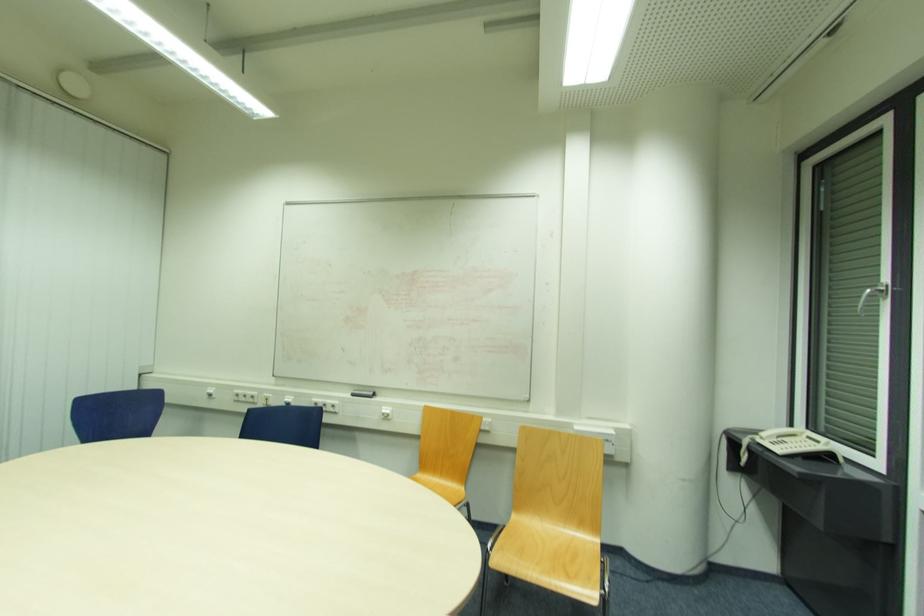
Where is `black whiteboard eraser`? The height and width of the screenshot is (616, 924). black whiteboard eraser is located at coordinates (362, 392).